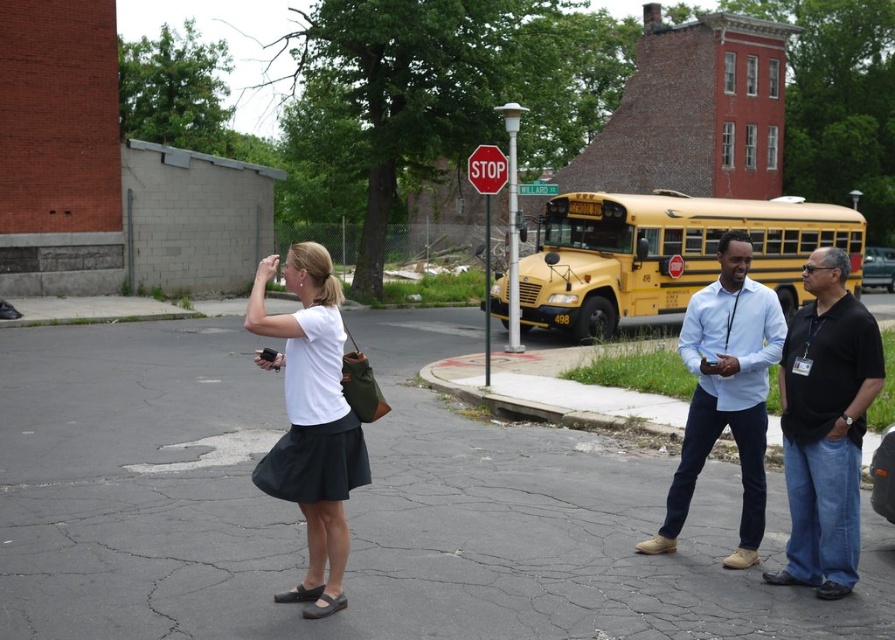
Question: Among these points, which one is farthest from the camera?

Choices:
 (A) (489, 173)
 (B) (861, 426)

Answer: (A)

Question: Is black cotton shirt at right thinner than red plastic stop sign at upper center?

Choices:
 (A) no
 (B) yes

Answer: (B)

Question: Which point appears closest to the camera in this image?

Choices:
 (A) (492, 168)
 (B) (624, 228)

Answer: (A)

Question: Considering the relative positions of black cotton shirt at right and red plastic stop sign at upper center in the image provided, where is black cotton shirt at right located with respect to red plastic stop sign at upper center?

Choices:
 (A) above
 (B) below

Answer: (B)

Question: Is yellow matte school bus at center wider than white matte shirt at center?

Choices:
 (A) yes
 (B) no

Answer: (A)

Question: Which of the following is the farthest from the observer?

Choices:
 (A) (322, 419)
 (B) (842, 289)
 (C) (800, 253)
 (D) (757, 400)

Answer: (C)